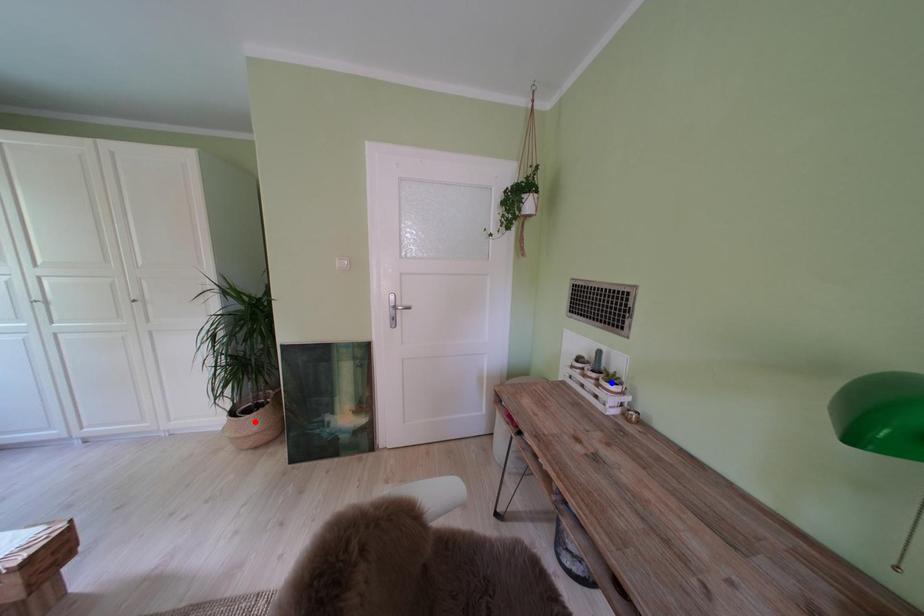
Question: In the image, two points are highlighted. Which point is nearer to the camera? Reply with the corresponding letter.

Choices:
 (A) blue point
 (B) red point

Answer: (A)